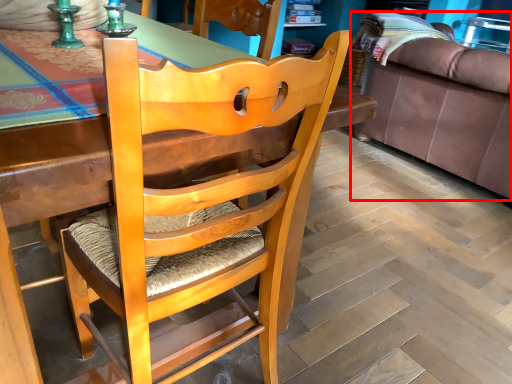
Question: From the image's perspective, where is studio couch (annotated by the red box) located relative to chair?

Choices:
 (A) below
 (B) above

Answer: (B)